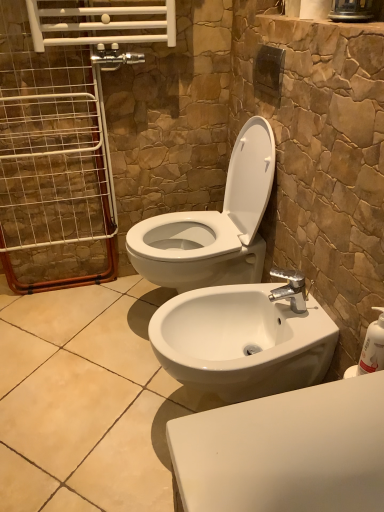
Describe the element at coordinates (242, 341) in the screenshot. The width and height of the screenshot is (384, 512). I see `white glossy sink at lower center` at that location.

Locate an element on the screen. Image resolution: width=384 pixels, height=512 pixels. white plastic soap dispenser at right is located at coordinates (373, 346).

Describe the element at coordinates (213, 225) in the screenshot. This screenshot has height=512, width=384. I see `white glossy toilet at center` at that location.

Find the location of a particular element. white glossy sink at lower center is located at coordinates (242, 341).

From a real-world perspective, which object rests below the other?

In real-world perspective, white glossy sink at lower center is lower.

Does point (272, 325) lie behind point (36, 97)?

No.

Which of these two, white glossy sink at lower center or white wire screen door at left, is bigger?

white glossy sink at lower center is bigger.

From a real-world perspective, which object rests below the other?

white plastic soap dispenser at right, from a real-world perspective.

Are white wire screen door at left and white plastic soap dispenser at right making contact?

No.

Based on the photo, from the image's perspective, which one is positioned higher, white wire screen door at left or white plastic soap dispenser at right?

white wire screen door at left, from the image's perspective.

Based on the photo, what's the angular difference between white wire screen door at left and white plastic soap dispenser at right's facing directions?

white wire screen door at left and white plastic soap dispenser at right are facing 92.4 degrees away from each other.

From the image's perspective, is white glossy toilet at center on white glossy sink at lower center?

Yes, from the image's perspective, white glossy toilet at center is over white glossy sink at lower center.

Is white glossy toilet at center oriented towards white glossy sink at lower center?

No.

Considering the positions of objects white glossy toilet at center and white glossy sink at lower center in the image provided, who is more to the right, white glossy toilet at center or white glossy sink at lower center?

white glossy sink at lower center is more to the right.

Is the depth of white glossy toilet at center less than that of white glossy sink at lower center?

No, white glossy toilet at center is further to the viewer.

Considering the sizes of objects white plastic soap dispenser at right and white glossy sink at lower center in the image provided, who is bigger, white plastic soap dispenser at right or white glossy sink at lower center?

With larger size is white glossy sink at lower center.

Between white plastic soap dispenser at right and white glossy sink at lower center, which one appears on the right side from the viewer's perspective?

Positioned to the right is white plastic soap dispenser at right.

From the picture: Is white plastic soap dispenser at right further to the viewer compared to white glossy sink at lower center?

That is False.

Consider the image. Choose the correct answer: Is white plastic soap dispenser at right inside white glossy sink at lower center or outside it?

white plastic soap dispenser at right cannot be found inside white glossy sink at lower center.

Does white wire screen door at left touch white glossy toilet at center?

white wire screen door at left and white glossy toilet at center are not in contact.

The image size is (384, 512). In order to click on toilet in front of the white wire screen door at left in this screenshot , I will do `click(213, 225)`.

Considering the relative positions of white wire screen door at left and white glossy toilet at center in the image provided, is white wire screen door at left to the right of white glossy toilet at center from the viewer's perspective?

In fact, white wire screen door at left is to the left of white glossy toilet at center.

From a real-world perspective, is white wire screen door at left physically below white glossy toilet at center?

Actually, white wire screen door at left is physically above white glossy toilet at center in the real world.

Is white glossy toilet at center facing away from white wire screen door at left?

No, white glossy toilet at center is not facing the opposite direction of white wire screen door at left.

Does white glossy toilet at center have a lesser height compared to white wire screen door at left?

Indeed, white glossy toilet at center has a lesser height compared to white wire screen door at left.

Is there a large distance between white glossy toilet at center and white wire screen door at left?

No, white glossy toilet at center is in close proximity to white wire screen door at left.

From the image's perspective, is white glossy toilet at center positioned above or below white wire screen door at left?

white glossy toilet at center is below white wire screen door at left.

Is white plastic soap dispenser at right closer to camera compared to white wire screen door at left?

That is True.

Considering the positions of point (378, 334) and point (79, 74), is point (378, 334) closer or farther from the camera than point (79, 74)?

Point (378, 334) appears to be closer to the viewer than point (79, 74).

From their relative heights in the image, would you say white plastic soap dispenser at right is taller or shorter than white wire screen door at left?

Considering their sizes, white plastic soap dispenser at right has less height than white wire screen door at left.

How distant is white plastic soap dispenser at right from white wire screen door at left?

white plastic soap dispenser at right and white wire screen door at left are 4.54 feet apart from each other.

Locate an element on the screen. The height and width of the screenshot is (512, 384). screen door behind the white glossy sink at lower center is located at coordinates (52, 159).

Image resolution: width=384 pixels, height=512 pixels. Identify the location of soap dispenser below the white wire screen door at left (from the image's perspective). click(x=373, y=346).

Looking at the image, which one is located further to white wire screen door at left, white plastic soap dispenser at right or white glossy sink at lower center?

Among the two, white plastic soap dispenser at right is located further to white wire screen door at left.

Considering their positions, is white plastic soap dispenser at right positioned closer to white wire screen door at left than white glossy toilet at center?

white glossy toilet at center lies closer to white wire screen door at left than the other object.

When comparing their distances from white glossy sink at lower center, does white plastic soap dispenser at right or white wire screen door at left seem further?

The object further to white glossy sink at lower center is white wire screen door at left.

Estimate the real-world distances between objects in this image. Which object is further from white glossy toilet at center, white wire screen door at left or white glossy sink at lower center?

white wire screen door at left is further to white glossy toilet at center.

Estimate the real-world distances between objects in this image. Which object is further from white glossy sink at lower center, white plastic soap dispenser at right or white glossy toilet at center?

The object further to white glossy sink at lower center is white plastic soap dispenser at right.

Which object lies further to the anchor point white plastic soap dispenser at right, white glossy toilet at center or white glossy sink at lower center?

Based on the image, white glossy toilet at center appears to be further to white plastic soap dispenser at right.

Considering their positions, is white glossy toilet at center positioned closer to white plastic soap dispenser at right than white wire screen door at left?

Based on the image, white glossy toilet at center appears to be nearer to white plastic soap dispenser at right.

In the scene shown: Considering their positions, is white wire screen door at left positioned further to white glossy toilet at center than white plastic soap dispenser at right?

white plastic soap dispenser at right lies further to white glossy toilet at center than the other object.

Locate an element on the screen. This screenshot has width=384, height=512. toilet situated between white wire screen door at left and white plastic soap dispenser at right from left to right is located at coordinates (213, 225).

Where is `toilet between white wire screen door at left and white glossy sink at lower center`? This screenshot has width=384, height=512. toilet between white wire screen door at left and white glossy sink at lower center is located at coordinates (213, 225).

This screenshot has height=512, width=384. In order to click on soap dispenser between white glossy toilet at center and white glossy sink at lower center vertically in this screenshot , I will do `click(373, 346)`.

I want to click on sink between white wire screen door at left and white plastic soap dispenser at right in the horizontal direction, so coord(242,341).